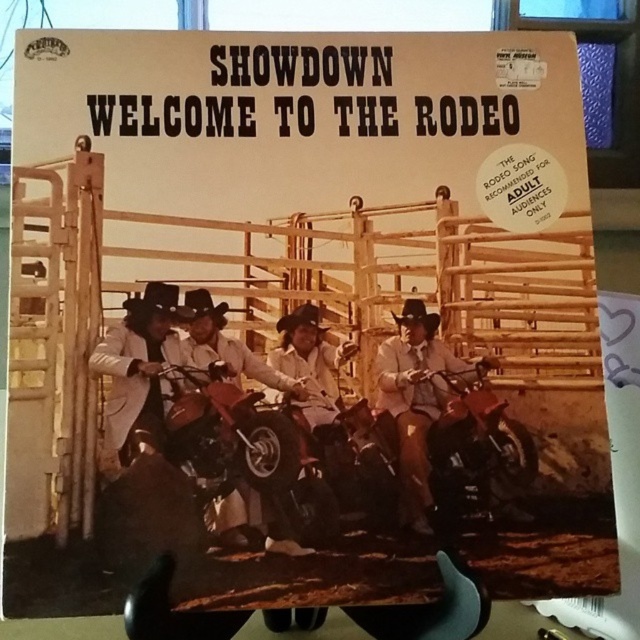
Is light brown leather jacket at center below black matte cowboy hat at center?

Yes, light brown leather jacket at center is below black matte cowboy hat at center.

Is light brown leather jacket at center positioned before black matte cowboy hat at center?

Yes, it is.

What do you see at coordinates (416, 400) in the screenshot? I see `light brown leather jacket at center` at bounding box center [416, 400].

Where is `light brown leather jacket at center`? This screenshot has height=640, width=640. light brown leather jacket at center is located at coordinates pos(416,400).

I want to click on black felt cowboy hat at left, so click(154, 300).

Can you confirm if black felt cowboy hat at left is wider than black matte cowboy hat at center?

Indeed, black felt cowboy hat at left has a greater width compared to black matte cowboy hat at center.

This screenshot has height=640, width=640. What do you see at coordinates (154, 300) in the screenshot? I see `black felt cowboy hat at left` at bounding box center [154, 300].

Where is `black felt cowboy hat at left`? The width and height of the screenshot is (640, 640). black felt cowboy hat at left is located at coordinates (154, 300).

Is point (266, 547) closer to camera compared to point (193, 292)?

Yes.

Measure the distance from leather cowboy hat at center to black felt cowboy hat at center.

leather cowboy hat at center is 4.33 inches away from black felt cowboy hat at center.

Who is more distant from viewer, (193, 300) or (208, 305)?

The point (208, 305) is more distant.

At what (x,y) coordinates should I click in order to perform the action: click on leather cowboy hat at center. Please return your answer as a coordinate pair (x, y). Looking at the image, I should click on (227, 344).